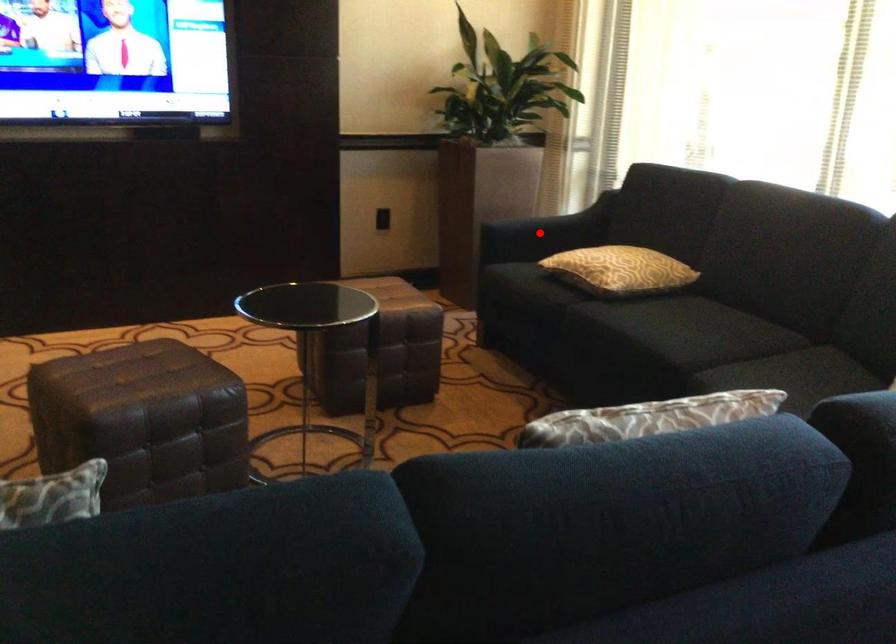
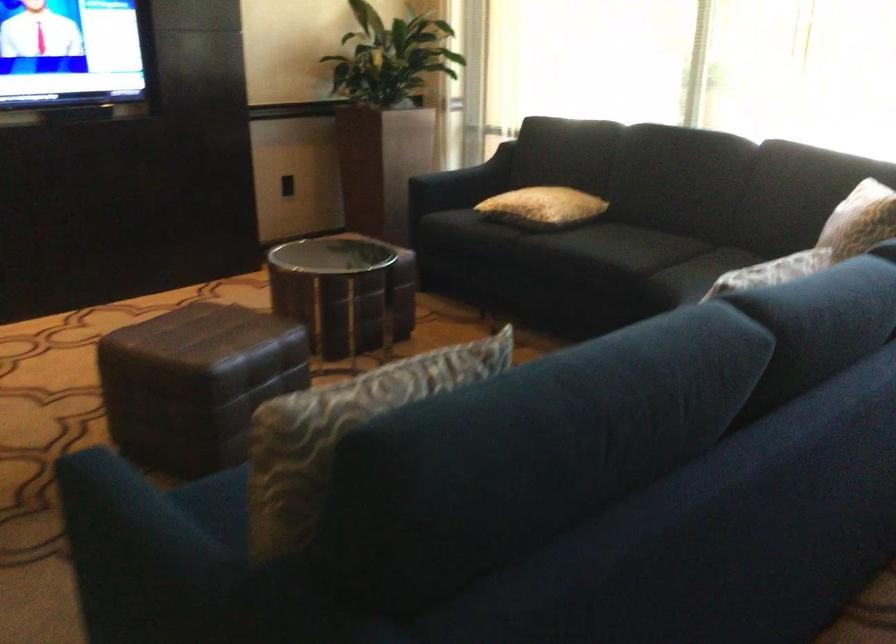
Find the pixel in the second image that matches the highlighted location in the first image.

(460, 184)